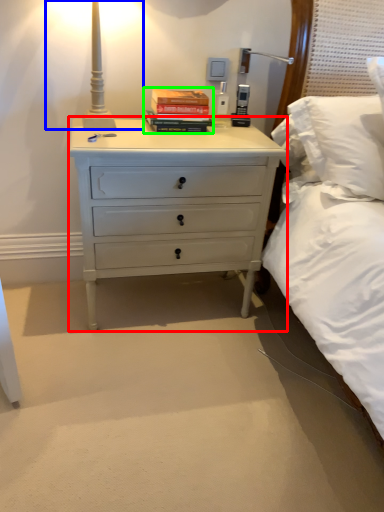
Question: Which object is positioned farthest from chest of drawers (highlighted by a red box)? Select from bedside lamp (highlighted by a blue box) and paperback book (highlighted by a green box).

Choices:
 (A) bedside lamp
 (B) paperback book

Answer: (A)